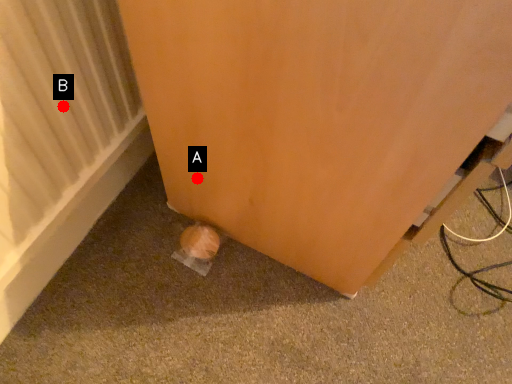
Question: Two points are circled on the image, labeled by A and B beside each circle. Which point is farther to the camera?

Choices:
 (A) A is further
 (B) B is further

Answer: (A)